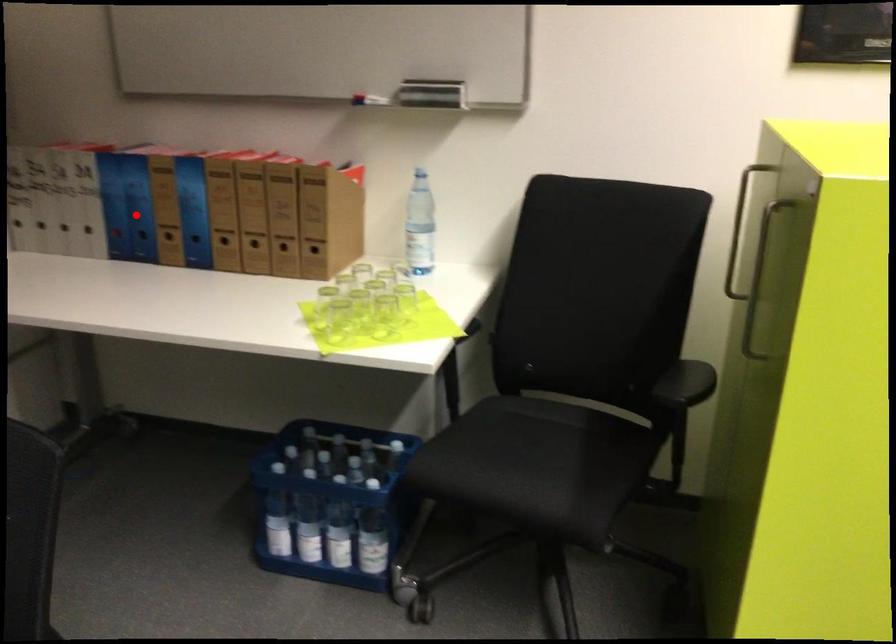
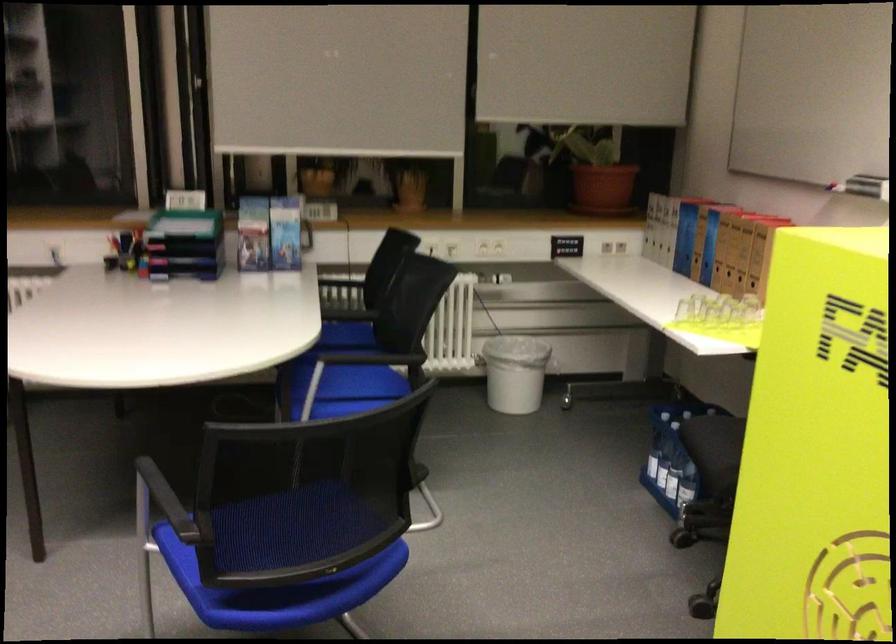
Question: I am providing you with two images of the same scene from different viewpoints. Given a red point in image1, look at the same physical point in image2. Is it:

Choices:
 (A) Closer to the viewpoint
 (B) Farther from the viewpoint

Answer: (B)